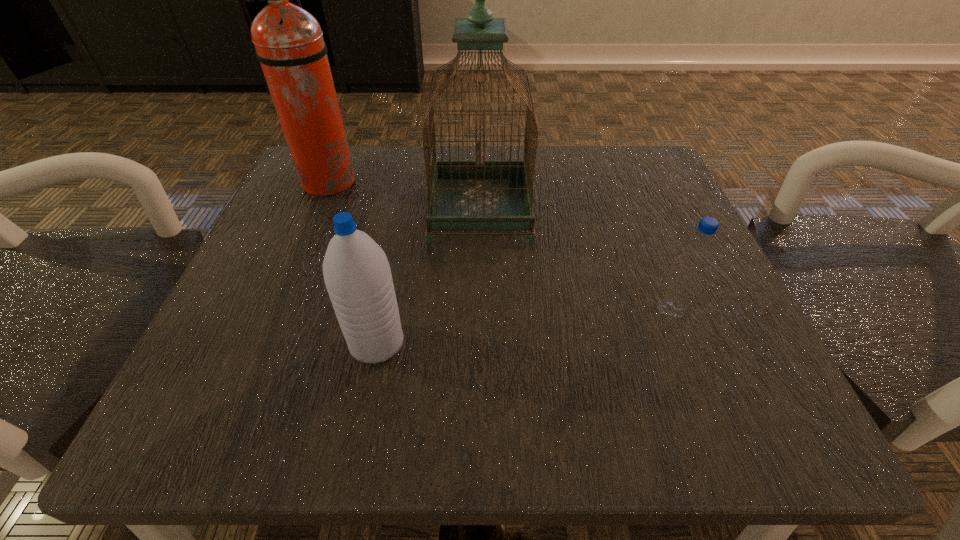
The width and height of the screenshot is (960, 540). Identify the location of fire extinguisher. point(289,43).

Where is `the second object from right to left`? The height and width of the screenshot is (540, 960). the second object from right to left is located at coordinates (463, 195).

Locate an element on the screen. The height and width of the screenshot is (540, 960). the taller water bottle is located at coordinates (357, 274).

Identify the location of the left water bottle. The image size is (960, 540). (357, 274).

Identify the location of the shortest object. Image resolution: width=960 pixels, height=540 pixels. (696, 252).

Locate an element on the screen. the rightmost object is located at coordinates (696, 252).

Identify the location of free region located 0.110m at the nozzle of the fire extinguisher. (411, 183).

Where is `vacant space located at the door of the birdcage`? The height and width of the screenshot is (540, 960). vacant space located at the door of the birdcage is located at coordinates (628, 211).

The image size is (960, 540). Find the location of `free space located on the left of the third object from right to left`. free space located on the left of the third object from right to left is located at coordinates [226, 343].

Where is `blank space located on the left of the rightmost object`? This screenshot has height=540, width=960. blank space located on the left of the rightmost object is located at coordinates (525, 310).